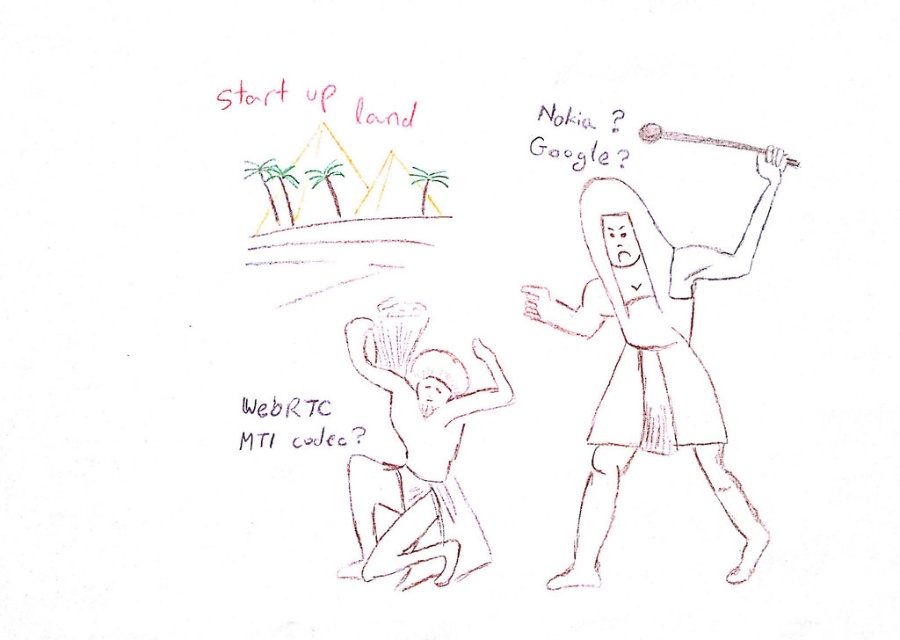
Based on the photo, based on the coordinates provided in the scene description, where is the smooth paper figure at right positioned?

The smooth paper figure at right is located at point 0.561 in the x coordinate and 0.724 in the y coordinate.

You are an observer looking at the illustration. Which figure is closer to you, the smooth paper figure at right or the smooth skin figure at lower left?

The smooth paper figure at right is closer because it is in front of the smooth skin figure at lower left.

You are an observer looking at the image. There are two points marked in the scene. The first point is at coordinates point (613, 241) and the second is at point (439, 406). Which of these two points is closer to you?

Point (613, 241) is closer to the viewer than point (439, 406).